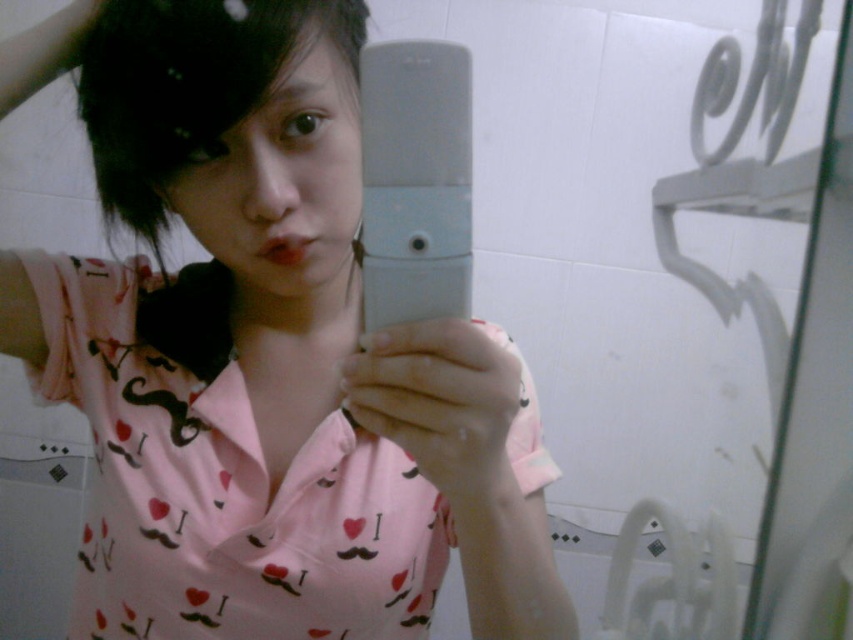
You are designing a virtual reality bathroom scene and need to ensure that the pink fabric shirt at center and the black matte hair at upper left are scaled appropriately. Based on the image, which object should be made larger in the VR environment?

The pink fabric shirt at center should be made larger in the VR environment because it is bigger than the black matte hair at upper left in the image.

Based on the photo, you are trying to take a selfie in a bathroom. You see the black matte hair at upper left and the gray matte smartphone at center. Which object is positioned more to the left?

The black matte hair at upper left is positioned more to the left than the gray matte smartphone at center.